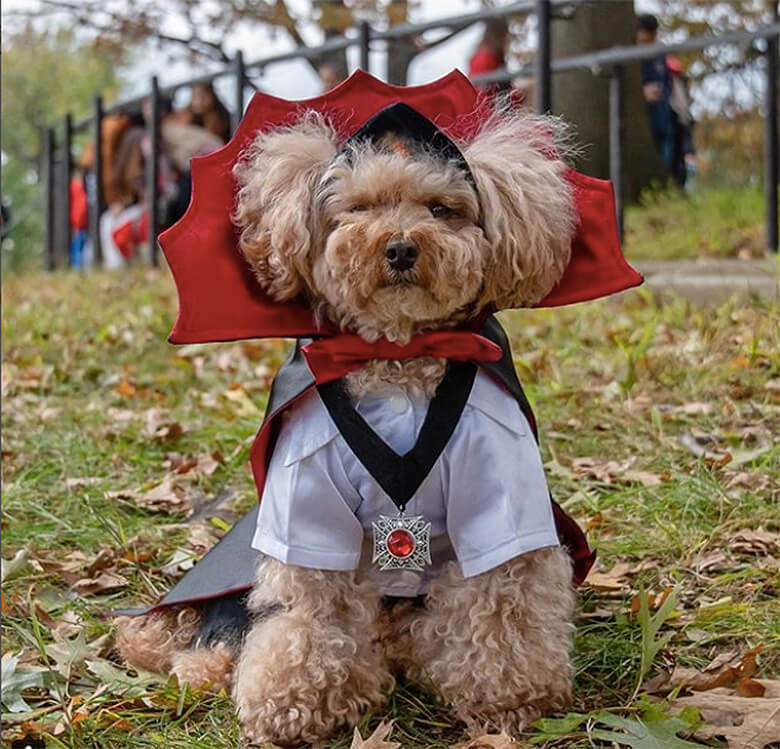
The height and width of the screenshot is (749, 780). Find the location of `pendant`. pendant is located at coordinates (395, 544).